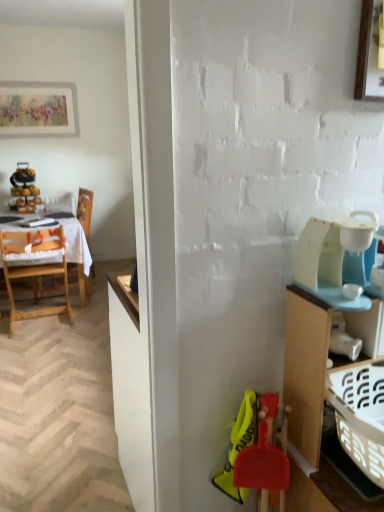
Where is `free spot to the right of wooden chair at left, the first chair positioned from the front`? free spot to the right of wooden chair at left, the first chair positioned from the front is located at coordinates (87, 321).